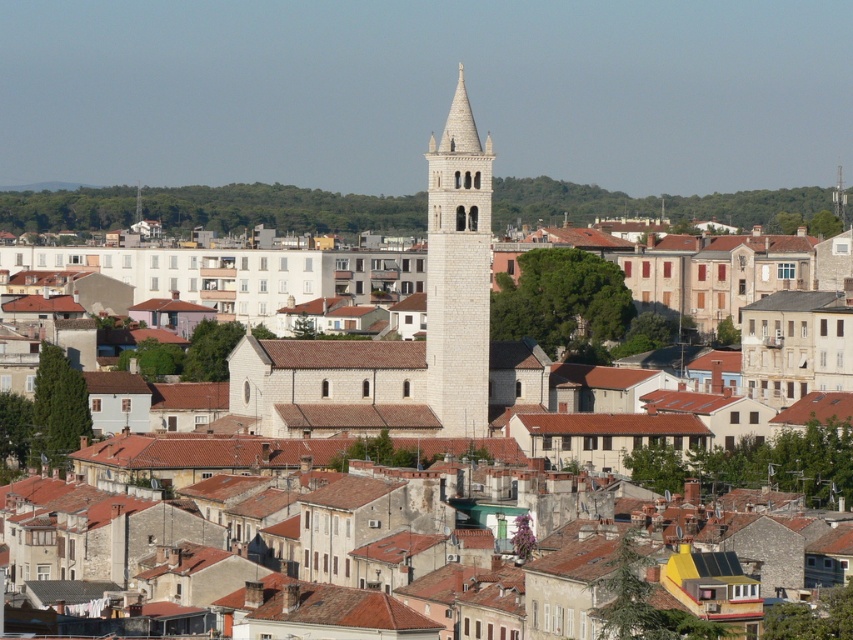
Question: Which point is closer to the camera?

Choices:
 (A) (755, 212)
 (B) (360, 417)

Answer: (B)

Question: Does white stone church at center have a lesser width compared to green leafy hillside at upper center?

Choices:
 (A) no
 (B) yes

Answer: (B)

Question: Which point is farther to the camera?

Choices:
 (A) (433, 140)
 (B) (140, 209)
 (C) (358, 358)
 (D) (88, 212)

Answer: (D)

Question: Which object is positioned closest to the white stone church at center?

Choices:
 (A) green leafy hillside at upper center
 (B) white stone bell tower at center

Answer: (B)

Question: Considering the relative positions of green leafy hillside at upper center and white stone bell tower at center in the image provided, where is green leafy hillside at upper center located with respect to white stone bell tower at center?

Choices:
 (A) right
 (B) left

Answer: (A)

Question: Can you confirm if white stone church at center is positioned below green leafy hillside at upper center?

Choices:
 (A) no
 (B) yes

Answer: (B)